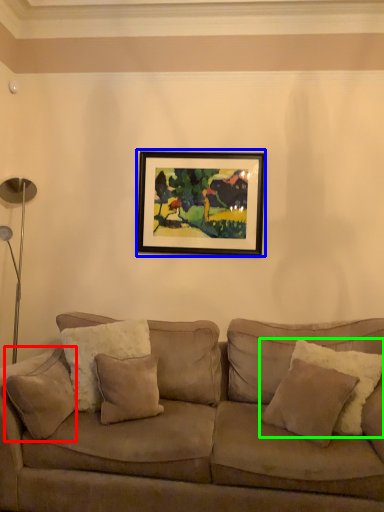
Question: Which object is the closest to the pillow (highlighted by a red box)? Choose among these: picture frame (highlighted by a blue box) or pillow (highlighted by a green box).

Choices:
 (A) picture frame
 (B) pillow

Answer: (B)